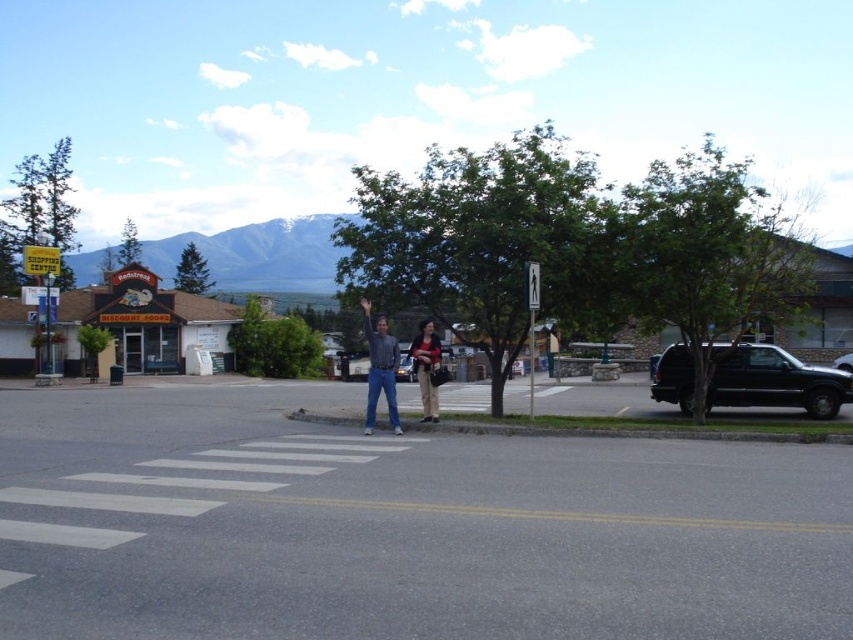
You are standing at the pedestrian crossing and want to cross the road to the mountains in the background. There is a black matte suv at right. Can you safely cross the road without getting too close to the suv?

The black matte suv at right is 18.69 meters away from you, so yes, you can safely cross the road without getting too close to the suv.

You are a drone operator who needs to capture a closeup shot of the point at coordinates (329, 257). The drone can fly up to 200 meters away from its starting position. Based on the scene, will the drone be able to reach the point?

The point at coordinates (329, 257) is 168.69 meters away from the camera, so yes, the drone can reach it since it is within the 200 meters range.

You are a pedestrian standing at the intersection and want to take a photo of the white matte building at left and the matte black jacket at center. Which object should you point your camera upwards to capture?

You should point your camera upwards to capture the white matte building at left because it is located above the matte black jacket at center.